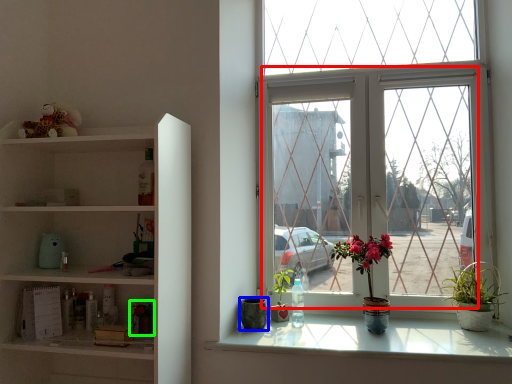
Question: Estimate the real-world distances between objects in this image. Which object is farther from glass window (highlighted by a red box), flowerpot (highlighted by a blue box) or houseplant (highlighted by a green box)?

Choices:
 (A) flowerpot
 (B) houseplant

Answer: (B)